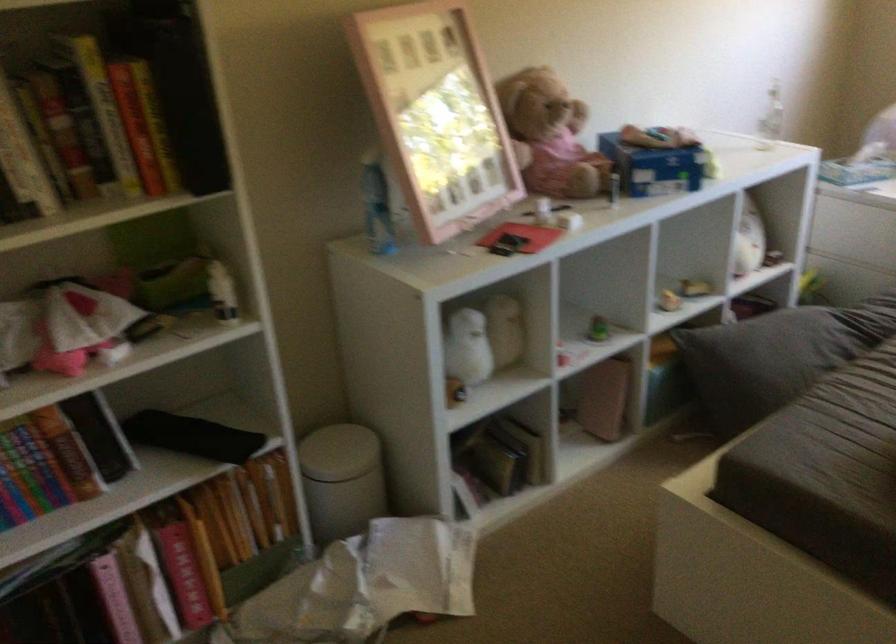
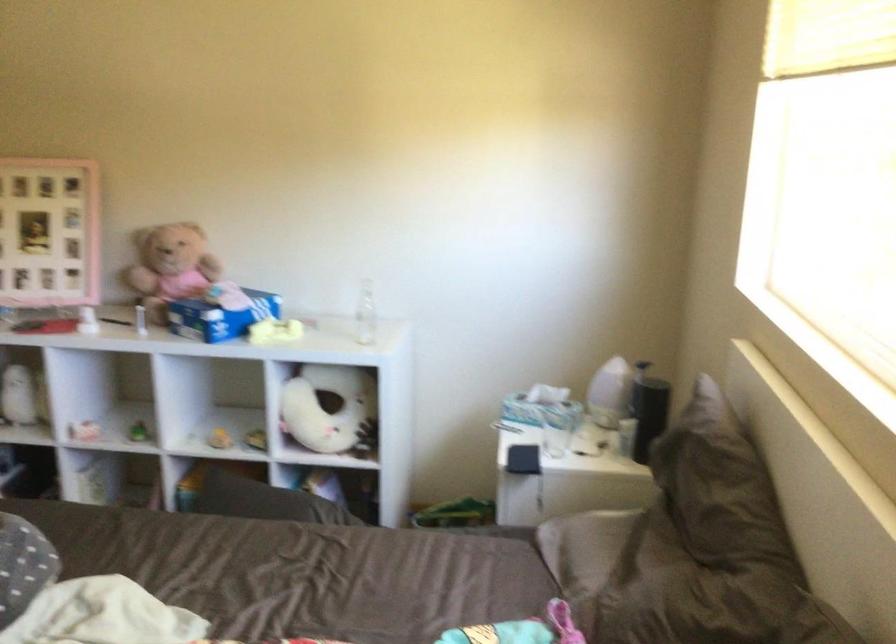
Locate, in the second image, the point that corresponds to [449,120] in the first image.

(48, 232)